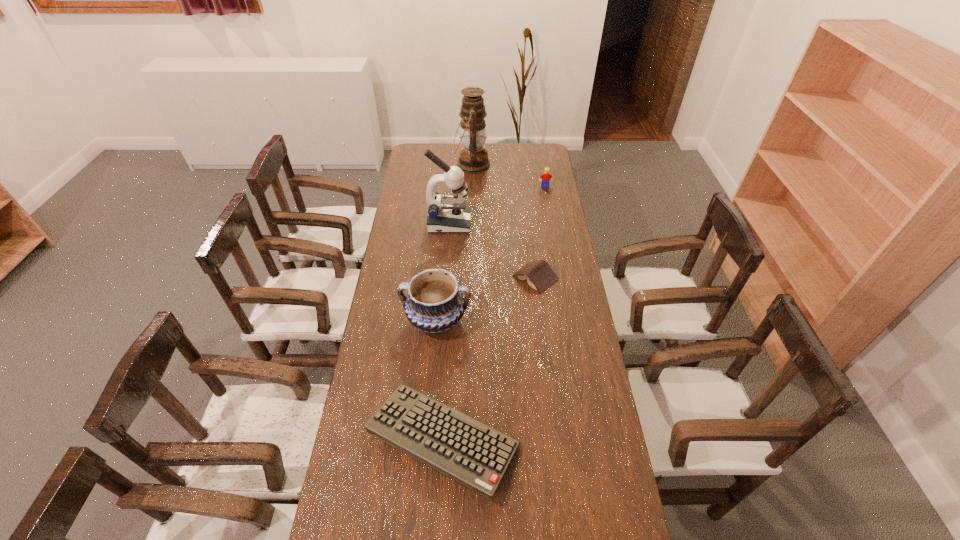
In order to click on vacant region between the fourth farthest object and the microscope in this screenshot , I will do `click(492, 250)`.

Find the location of a particular element. This screenshot has height=540, width=960. vacant space that's between the pottery and the lantern is located at coordinates (454, 242).

The height and width of the screenshot is (540, 960). I want to click on free space between the fourth shortest object and the Lego, so click(491, 253).

Locate an element on the screen. object that ranks as the second closest to the lantern is located at coordinates (447, 214).

Locate an element on the screen. This screenshot has width=960, height=540. object that stands as the fourth closest to the Lego is located at coordinates (435, 303).

At what (x,y) coordinates should I click in order to perform the action: click on vacant point that satisfies the following two spatial constraints: 1. on the back side of the fifth tallest object; 2. on the left side of the farthest object. Please return your answer as a coordinate pair (x, y). This screenshot has height=540, width=960. Looking at the image, I should click on (459, 165).